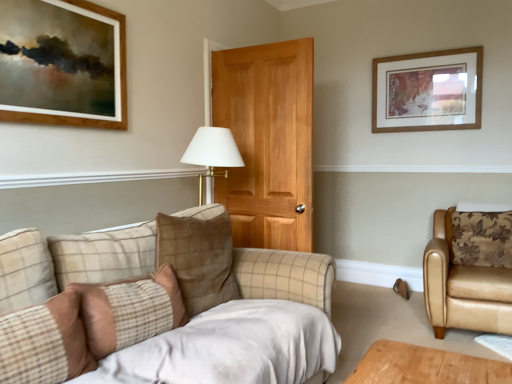
Describe the element at coordinates (198, 259) in the screenshot. This screenshot has height=384, width=512. I see `brown checkered pillow at center, which appears as the 2th pillow when viewed from the back` at that location.

How much space does brown checkered pillow at center, which is the 2th pillow in right-to-left order, occupy horizontally?

It is 8.46 inches.

Where is `tan leather armchair at right`? The image size is (512, 384). tan leather armchair at right is located at coordinates (463, 287).

What do you see at coordinates (463, 287) in the screenshot?
I see `tan leather armchair at right` at bounding box center [463, 287].

At what (x,y) coordinates should I click in order to perform the action: click on wooden framed artwork at upper right. Please return your answer as a coordinate pair (x, y). Image resolution: width=512 pixels, height=384 pixels. Looking at the image, I should click on (428, 91).

Where is `plaid fabric pillow at lower left, placed as the third pillow when sorted from right to left`? This screenshot has height=384, width=512. plaid fabric pillow at lower left, placed as the third pillow when sorted from right to left is located at coordinates (129, 310).

Image resolution: width=512 pixels, height=384 pixels. Describe the element at coordinates (45, 342) in the screenshot. I see `brown plaid pillow at lower left, the 4th pillow in the right-to-left sequence` at that location.

The width and height of the screenshot is (512, 384). What are the coordinates of `floral-patterned leather pillow at right, the 1th pillow when ordered from right to left` in the screenshot? It's located at (481, 238).

The image size is (512, 384). I want to click on brown checkered pillow at center, the 3th pillow from the left, so click(198, 259).

Is plaid fabric pillow at lower left, placed as the third pillow when sorted from right to left, shorter than brown plaid pillow at lower left, the 4th pillow in the right-to-left sequence?

Incorrect, the height of plaid fabric pillow at lower left, placed as the third pillow when sorted from right to left, does not fall short of that of brown plaid pillow at lower left, the 4th pillow in the right-to-left sequence.

Does plaid fabric pillow at lower left, placed as the third pillow when sorted from right to left, have a lesser width compared to brown plaid pillow at lower left, the first pillow in the left-to-right sequence?

In fact, plaid fabric pillow at lower left, placed as the third pillow when sorted from right to left, might be wider than brown plaid pillow at lower left, the first pillow in the left-to-right sequence.

From the image's perspective, is plaid fabric pillow at lower left, placed as the third pillow when sorted from right to left, located beneath brown plaid pillow at lower left, acting as the first pillow starting from the front?

No, from the image's perspective, plaid fabric pillow at lower left, placed as the third pillow when sorted from right to left, is not beneath brown plaid pillow at lower left, acting as the first pillow starting from the front.

From a real-world perspective, which is physically below, floral-patterned leather pillow at right, the fourth pillow when ordered from left to right, or wooden framed artwork at upper right?

floral-patterned leather pillow at right, the fourth pillow when ordered from left to right, from a real-world perspective.

Would you say floral-patterned leather pillow at right, which is the fourth pillow in front-to-back order, is outside wooden framed artwork at upper right?

Absolutely, floral-patterned leather pillow at right, which is the fourth pillow in front-to-back order, is external to wooden framed artwork at upper right.

Which is more to the left, floral-patterned leather pillow at right, the 1th pillow when ordered from right to left, or wooden framed artwork at upper right?

wooden framed artwork at upper right is more to the left.

In terms of height, does floral-patterned leather pillow at right, which is the fourth pillow in front-to-back order, look taller or shorter compared to wooden framed artwork at upper right?

Considering their sizes, floral-patterned leather pillow at right, which is the fourth pillow in front-to-back order, has less height than wooden framed artwork at upper right.

Which object is wider, plaid fabric pillow at lower left, marked as the second pillow in a front-to-back arrangement, or brown checkered pillow at center, which is the 3th pillow in front-to-back order?

plaid fabric pillow at lower left, marked as the second pillow in a front-to-back arrangement, is wider.

What's the angular difference between plaid fabric pillow at lower left, placed as the 3th pillow when sorted from back to front, and brown checkered pillow at center, which is the 3th pillow in front-to-back order,'s facing directions?

plaid fabric pillow at lower left, placed as the 3th pillow when sorted from back to front, and brown checkered pillow at center, which is the 3th pillow in front-to-back order, are facing 0.592 degrees away from each other.

Would you say plaid fabric pillow at lower left, marked as the second pillow in a front-to-back arrangement, is to the left or to the right of brown checkered pillow at center, which is the 2th pillow in right-to-left order, in the picture?

Clearly, plaid fabric pillow at lower left, marked as the second pillow in a front-to-back arrangement, is on the left of brown checkered pillow at center, which is the 2th pillow in right-to-left order, in the image.

Is plaid fabric pillow at lower left, placed as the third pillow when sorted from right to left, positioned in front of brown checkered pillow at center, which appears as the 2th pillow when viewed from the back?

Yes, plaid fabric pillow at lower left, placed as the third pillow when sorted from right to left, is in front of brown checkered pillow at center, which appears as the 2th pillow when viewed from the back.

Considering the sizes of wooden framed artwork at upper right and tan leather armchair at right in the image, is wooden framed artwork at upper right wider or thinner than tan leather armchair at right?

In the image, wooden framed artwork at upper right appears to be more narrow than tan leather armchair at right.

The image size is (512, 384). I want to click on chair that is in front of the wooden framed artwork at upper right, so click(x=463, y=287).

Is wooden framed artwork at upper right inside or outside of tan leather armchair at right?

wooden framed artwork at upper right is outside tan leather armchair at right.

Is tan leather armchair at right not within wooden framed artwork at upper right?

Answer: Yes, tan leather armchair at right is not within wooden framed artwork at upper right.

Does tan leather armchair at right touch wooden framed artwork at upper right?

They are not placed beside each other.

From a real-world perspective, relative to wooden framed artwork at upper right, is tan leather armchair at right vertically above or below?

From a real-world perspective, tan leather armchair at right is physically below wooden framed artwork at upper right.

From the image's perspective, which is below, tan leather armchair at right or wooden framed artwork at upper right?

tan leather armchair at right, from the image's perspective.

In terms of height, does plaid fabric pillow at lower left, marked as the second pillow in a front-to-back arrangement, look taller or shorter compared to floral-patterned leather pillow at right, which appears as the first pillow when viewed from the back?

In the image, plaid fabric pillow at lower left, marked as the second pillow in a front-to-back arrangement, appears to be shorter than floral-patterned leather pillow at right, which appears as the first pillow when viewed from the back.

Could you tell me if plaid fabric pillow at lower left, acting as the second pillow starting from the left, is turned towards floral-patterned leather pillow at right, which appears as the first pillow when viewed from the back?

No, plaid fabric pillow at lower left, acting as the second pillow starting from the left, is not aimed at floral-patterned leather pillow at right, which appears as the first pillow when viewed from the back.

From the image's perspective, is plaid fabric pillow at lower left, placed as the 3th pillow when sorted from back to front, located above or below floral-patterned leather pillow at right, which is the fourth pillow in front-to-back order?

From the image's perspective, plaid fabric pillow at lower left, placed as the 3th pillow when sorted from back to front, appears below floral-patterned leather pillow at right, which is the fourth pillow in front-to-back order.

Consider the image. From a real-world perspective, between plaid fabric pillow at lower left, placed as the third pillow when sorted from right to left, and floral-patterned leather pillow at right, the fourth pillow when ordered from left to right, who is vertically lower?

In real-world perspective, plaid fabric pillow at lower left, placed as the third pillow when sorted from right to left, is lower.

From a real-world perspective, relative to floral-patterned leather pillow at right, which is the fourth pillow in front-to-back order, is brown plaid pillow at lower left, marked as the 4th pillow in a back-to-front arrangement, vertically above or below?

brown plaid pillow at lower left, marked as the 4th pillow in a back-to-front arrangement, is below floral-patterned leather pillow at right, which is the fourth pillow in front-to-back order.

Can you confirm if brown plaid pillow at lower left, the 4th pillow in the right-to-left sequence, is positioned to the right of floral-patterned leather pillow at right, the fourth pillow when ordered from left to right?

No, brown plaid pillow at lower left, the 4th pillow in the right-to-left sequence, is not to the right of floral-patterned leather pillow at right, the fourth pillow when ordered from left to right.

Considering the points (10, 322) and (509, 223), which point is behind, point (10, 322) or point (509, 223)?

The point (509, 223) is more distant.

Considering the positions of objects brown plaid pillow at lower left, marked as the 4th pillow in a back-to-front arrangement, and floral-patterned leather pillow at right, which is the fourth pillow in front-to-back order, in the image provided, who is behind, brown plaid pillow at lower left, marked as the 4th pillow in a back-to-front arrangement, or floral-patterned leather pillow at right, which is the fourth pillow in front-to-back order,?

floral-patterned leather pillow at right, which is the fourth pillow in front-to-back order, is more distant.

From the brown plaid pillow at lower left, acting as the first pillow starting from the front, count 1st pillows backward and point to it. Please provide its 2D coordinates.

[(129, 310)]

This screenshot has width=512, height=384. Identify the location of pillow that is the 2nd one below the wooden framed artwork at upper right (from a real-world perspective). (481, 238).

When comparing their distances from brown checkered pillow at center, which appears as the 2th pillow when viewed from the back, does plaid fabric pillow at lower left, placed as the 3th pillow when sorted from back to front, or tan leather armchair at right seem further?

The object further to brown checkered pillow at center, which appears as the 2th pillow when viewed from the back, is tan leather armchair at right.

Estimate the real-world distances between objects in this image. Which object is closer to brown plaid pillow at lower left, acting as the first pillow starting from the front, brown checkered pillow at center, which is the 2th pillow in right-to-left order, or wooden framed artwork at upper right?

Among the two, brown checkered pillow at center, which is the 2th pillow in right-to-left order, is located nearer to brown plaid pillow at lower left, acting as the first pillow starting from the front.

Estimate the real-world distances between objects in this image. Which object is further from tan leather armchair at right, wooden framed artwork at upper right or brown plaid pillow at lower left, acting as the first pillow starting from the front?

The object further to tan leather armchair at right is brown plaid pillow at lower left, acting as the first pillow starting from the front.

Looking at the image, which one is located closer to brown plaid pillow at lower left, the 4th pillow in the right-to-left sequence, tan leather armchair at right or wooden framed artwork at upper right?

tan leather armchair at right is positioned closer to the anchor brown plaid pillow at lower left, the 4th pillow in the right-to-left sequence.

Estimate the real-world distances between objects in this image. Which object is further from brown checkered pillow at center, which is the 3th pillow in front-to-back order, plaid fabric pillow at lower left, acting as the second pillow starting from the left, or brown plaid pillow at lower left, acting as the first pillow starting from the front?

brown plaid pillow at lower left, acting as the first pillow starting from the front, lies further to brown checkered pillow at center, which is the 3th pillow in front-to-back order, than the other object.

Looking at the image, which one is located closer to wooden framed artwork at upper right, brown checkered pillow at center, which is the 3th pillow in front-to-back order, or plaid fabric pillow at lower left, placed as the third pillow when sorted from right to left?

brown checkered pillow at center, which is the 3th pillow in front-to-back order, lies closer to wooden framed artwork at upper right than the other object.

Estimate the real-world distances between objects in this image. Which object is further from brown plaid pillow at lower left, marked as the 4th pillow in a back-to-front arrangement, wooden framed artwork at upper right or brown checkered pillow at center, which is the 3th pillow in front-to-back order?

Among the two, wooden framed artwork at upper right is located further to brown plaid pillow at lower left, marked as the 4th pillow in a back-to-front arrangement.

Estimate the real-world distances between objects in this image. Which object is further from wooden framed artwork at upper right, brown plaid pillow at lower left, the first pillow in the left-to-right sequence, or brown checkered pillow at center, which is the 2th pillow in right-to-left order?

brown plaid pillow at lower left, the first pillow in the left-to-right sequence.

The image size is (512, 384). In order to click on pillow located between plaid fabric pillow at lower left, marked as the second pillow in a front-to-back arrangement, and tan leather armchair at right in the left-right direction in this screenshot , I will do `click(198, 259)`.

You are a GUI agent. You are given a task and a screenshot of the screen. Output one action in this format:
    pyautogui.click(x=<x>, y=<y>)
    Task: Click on the chair situated between plaid fabric pillow at lower left, placed as the third pillow when sorted from right to left, and floral-patterned leather pillow at right, which appears as the first pillow when viewed from the back, from left to right
    This screenshot has height=384, width=512.
    Given the screenshot: What is the action you would take?
    pyautogui.click(x=463, y=287)

You are a GUI agent. You are given a task and a screenshot of the screen. Output one action in this format:
    pyautogui.click(x=<x>, y=<y>)
    Task: Click on the picture frame between brown plaid pillow at lower left, the 4th pillow in the right-to-left sequence, and floral-patterned leather pillow at right, the 1th pillow when ordered from right to left
    The image size is (512, 384).
    Given the screenshot: What is the action you would take?
    pyautogui.click(x=428, y=91)

You are a GUI agent. You are given a task and a screenshot of the screen. Output one action in this format:
    pyautogui.click(x=<x>, y=<y>)
    Task: Click on the picture frame situated between brown plaid pillow at lower left, acting as the first pillow starting from the front, and tan leather armchair at right from left to right
    Image resolution: width=512 pixels, height=384 pixels.
    Given the screenshot: What is the action you would take?
    pyautogui.click(x=428, y=91)